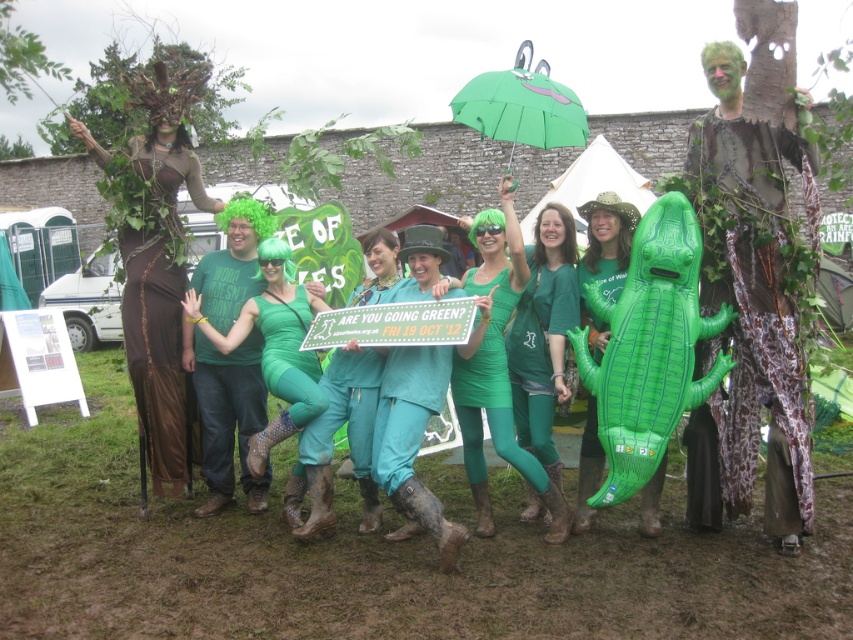
Question: Which point appears closest to the camera in this image?

Choices:
 (A) (299, 307)
 (B) (238, 410)

Answer: (A)

Question: Is camouflage fabric tree at right closer to camera compared to green matte tights at center?

Choices:
 (A) yes
 (B) no

Answer: (A)

Question: Which of the following is the farthest from the observer?

Choices:
 (A) brown textured dress at left
 (B) green matte bodysuit at center
 (C) green matte rubber boots at center
 (D) green matte umbrella at upper center

Answer: (D)

Question: Which object is closer to the camera taking this photo?

Choices:
 (A) green matte umbrella at upper center
 (B) camouflage fabric tree at right
 (C) green matte tights at center
 (D) matte green rubber boots at center

Answer: (D)

Question: Can you confirm if matte green rubber boots at center is positioned below green matte rubber boots at center?

Choices:
 (A) no
 (B) yes

Answer: (B)

Question: Is camouflage fabric tree at right positioned before green matte umbrella at upper center?

Choices:
 (A) yes
 (B) no

Answer: (A)